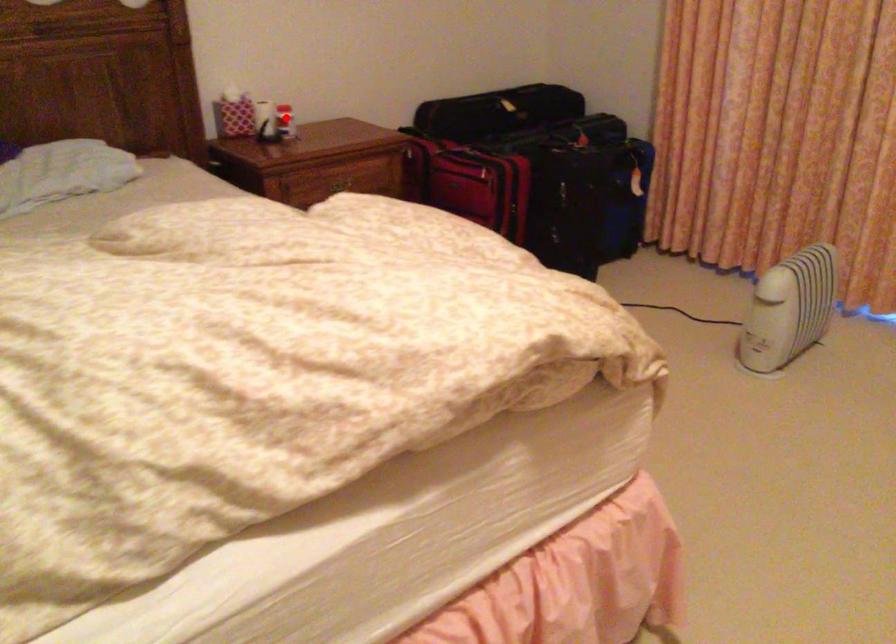
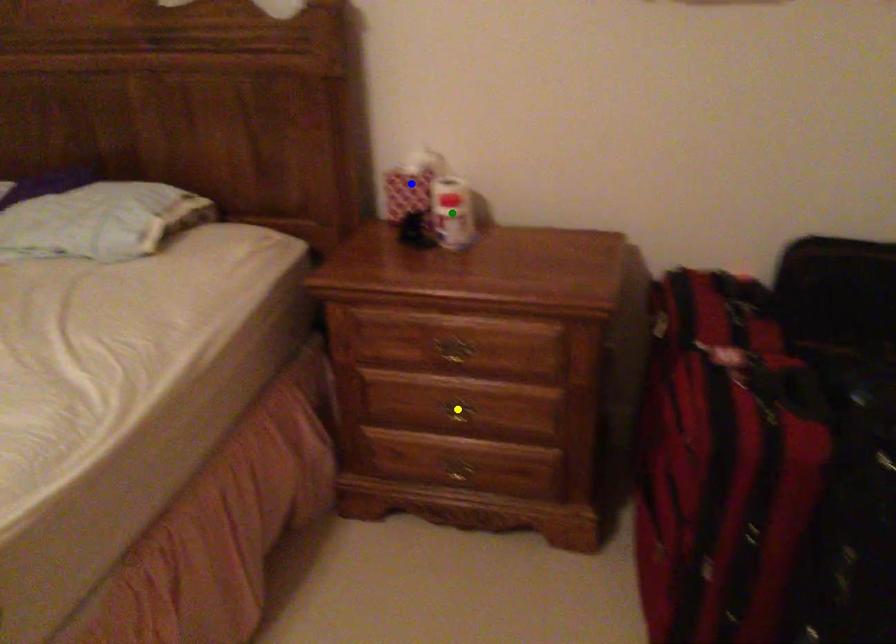
Question: I am providing you with two images of the same scene from different viewpoints. A red point is marked on the first image. You are given multiple points on the second image. Which point in image 2 represents the same 3d spot as the red point in image 1?

Choices:
 (A) green point
 (B) blue point
 (C) yellow point

Answer: (A)